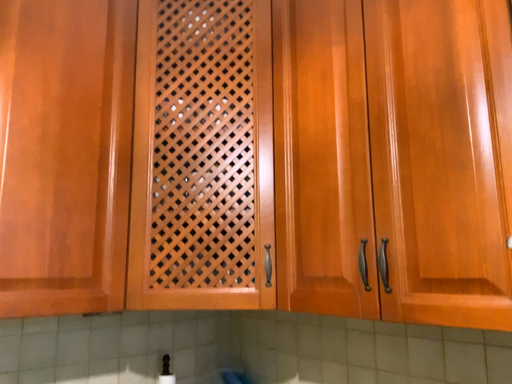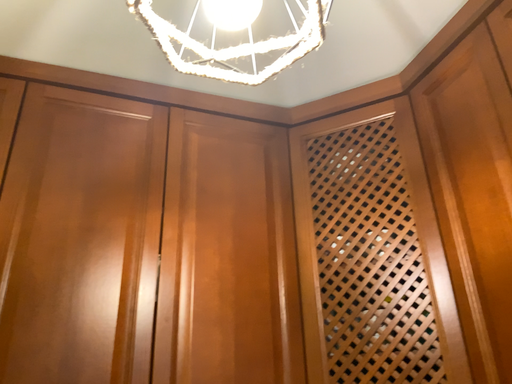
Question: Which way did the camera rotate in the video?

Choices:
 (A) rotated downward
 (B) rotated upward

Answer: (B)